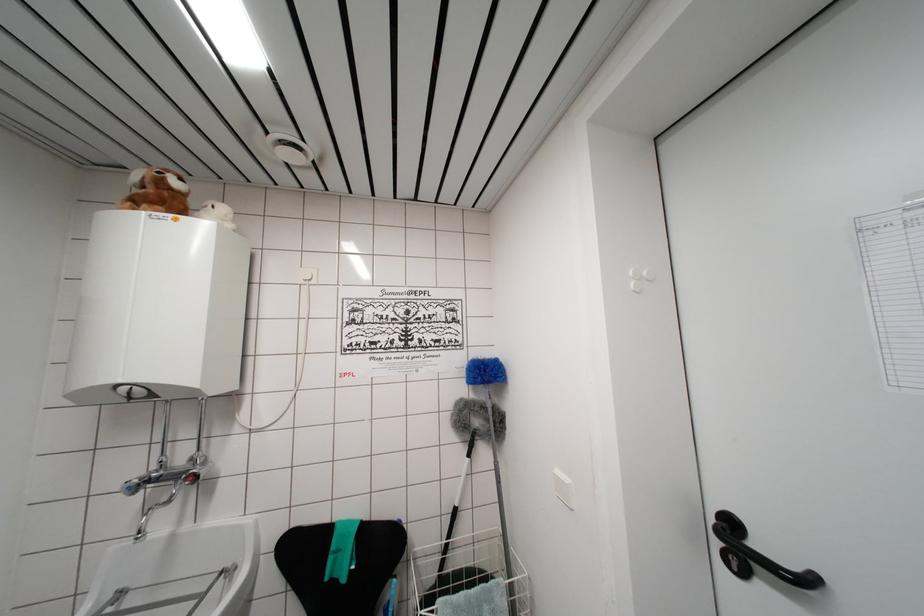
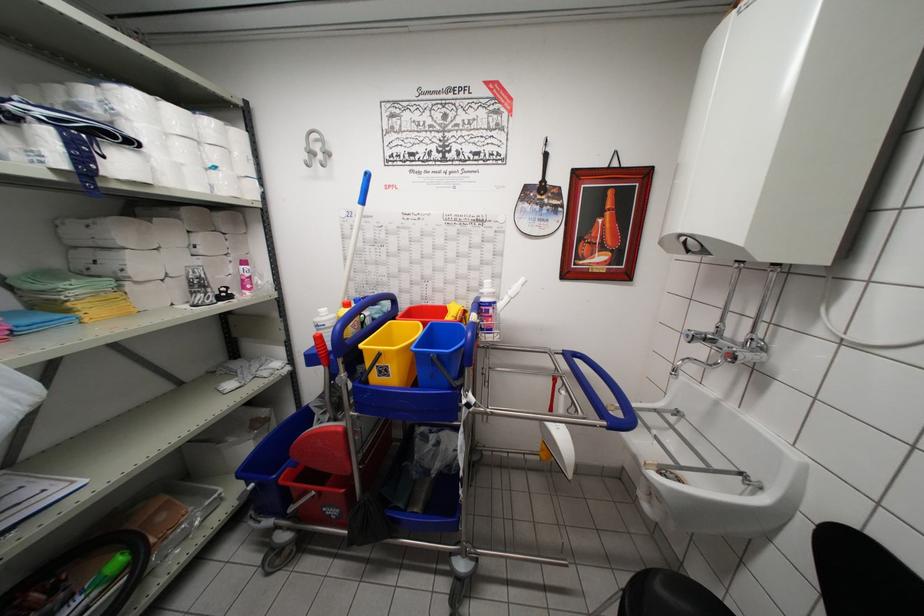
Question: The first image is from the beginning of the video and the second image is from the end. How did the camera likely rotate when shooting the video?

Choices:
 (A) Left
 (B) Right
 (C) Up
 (D) Down

Answer: (A)